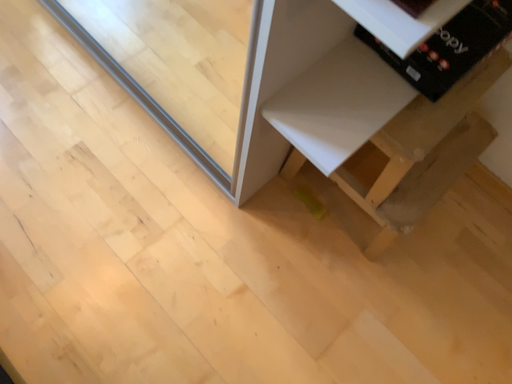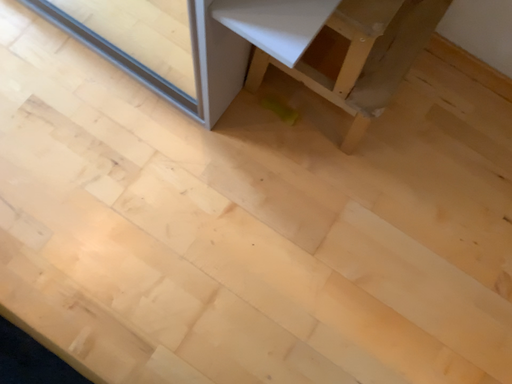
Question: Which way did the camera rotate in the video?

Choices:
 (A) rotated downward
 (B) rotated upward

Answer: (A)